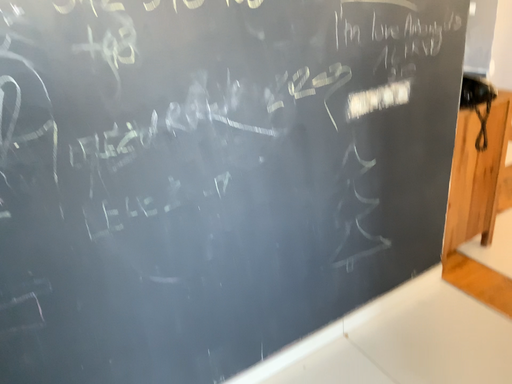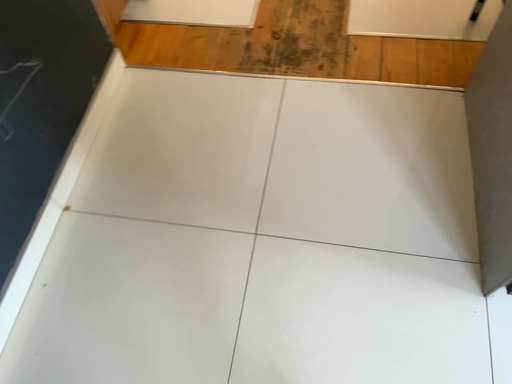
Question: Which way did the camera rotate in the video?

Choices:
 (A) rotated left
 (B) rotated right

Answer: (B)